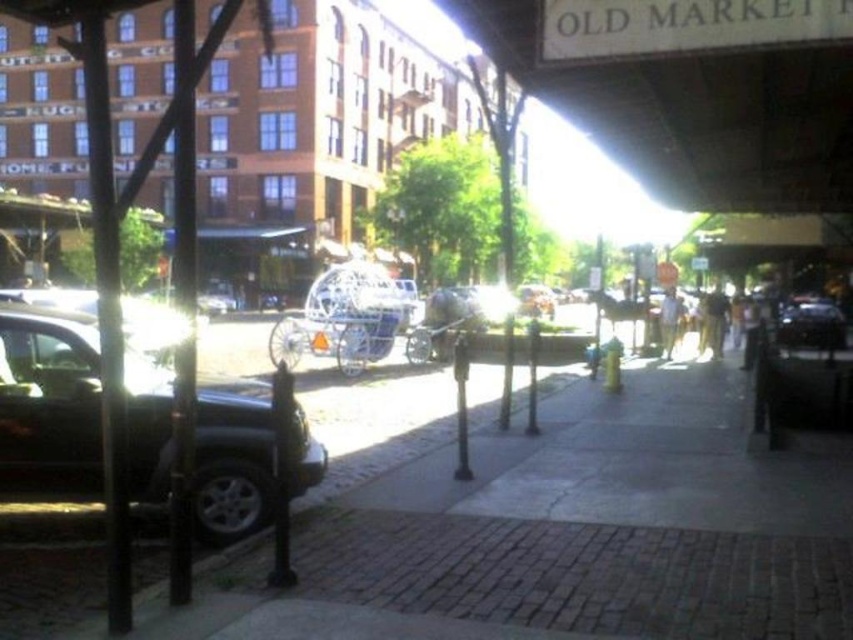
Does wooden signboard at upper center have a larger size compared to shiny black car at right?

Yes.

What do you see at coordinates (694, 113) in the screenshot? The height and width of the screenshot is (640, 853). I see `wooden signboard at upper center` at bounding box center [694, 113].

Where is `wooden signboard at upper center`? The height and width of the screenshot is (640, 853). wooden signboard at upper center is located at coordinates (694, 113).

Where is `wooden signboard at upper center`? The image size is (853, 640). wooden signboard at upper center is located at coordinates (694, 113).

Does shiny black car at left come in front of shiny black car at right?

Yes, shiny black car at left is in front of shiny black car at right.

Which of these two, shiny black car at left or shiny black car at right, stands shorter?

Standing shorter between the two is shiny black car at right.

Is point (161, 422) positioned behind point (822, 339)?

That is False.

You are a GUI agent. You are given a task and a screenshot of the screen. Output one action in this format:
    pyautogui.click(x=<x>, y=<y>)
    Task: Click on the shiny black car at left
    
    Given the screenshot: What is the action you would take?
    pyautogui.click(x=48, y=403)

From the picture: Is wooden signboard at upper center closer to the viewer compared to shiny black car at left?

No, it is not.

Which is above, wooden signboard at upper center or shiny black car at left?

wooden signboard at upper center is higher up.

At what (x,y) coordinates should I click in order to perform the action: click on wooden signboard at upper center. Please return your answer as a coordinate pair (x, y). Image resolution: width=853 pixels, height=640 pixels. Looking at the image, I should click on (694, 113).